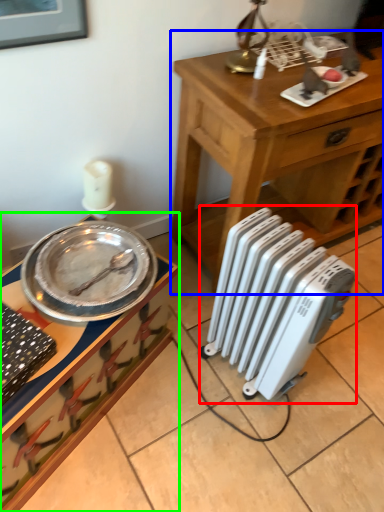
Question: Which object is the farthest from radiator (highlighted by a red box)? Choose among these: table (highlighted by a blue box) or desk (highlighted by a green box).

Choices:
 (A) table
 (B) desk

Answer: (A)